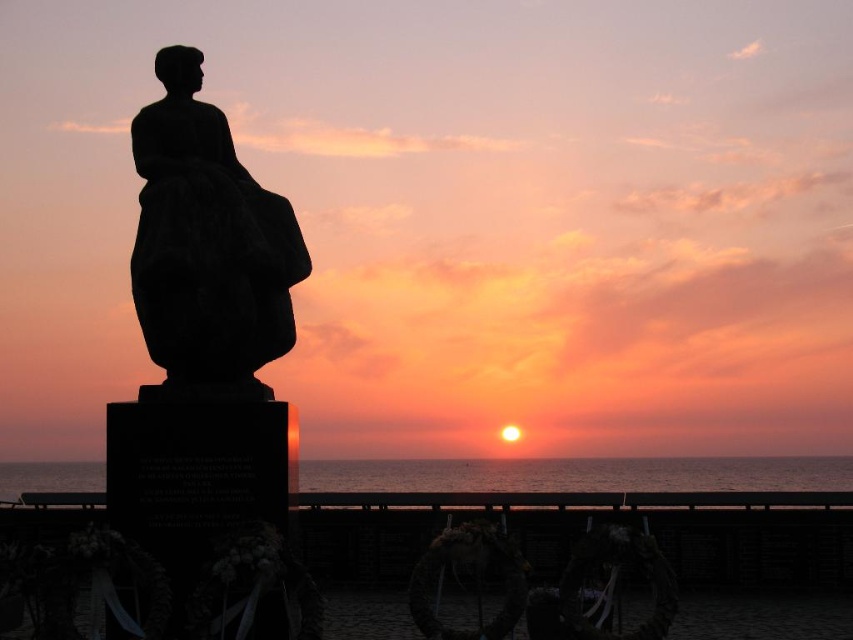
Question: Is black stone statue at left to the left of smooth ocean water at center from the viewer's perspective?

Choices:
 (A) yes
 (B) no

Answer: (A)

Question: Which point is farther to the camera?

Choices:
 (A) smooth ocean water at center
 (B) black stone statue at left

Answer: (A)

Question: In this image, where is black stone statue at left located relative to smooth ocean water at center?

Choices:
 (A) right
 (B) left

Answer: (B)

Question: Can you confirm if black stone statue at left is smaller than smooth ocean water at center?

Choices:
 (A) no
 (B) yes

Answer: (B)

Question: Among these objects, which one is nearest to the camera?

Choices:
 (A) smooth ocean water at center
 (B) black stone statue at left

Answer: (B)

Question: Which point appears farthest from the camera in this image?

Choices:
 (A) (598, 488)
 (B) (190, 97)

Answer: (A)